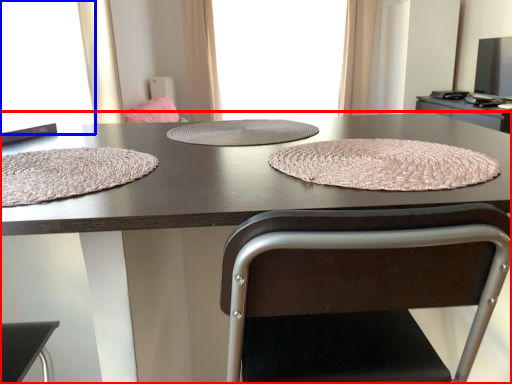
Question: Which of the following is the farthest to the observer, table (highlighted by a red box) or window screen (highlighted by a blue box)?

Choices:
 (A) table
 (B) window screen

Answer: (B)